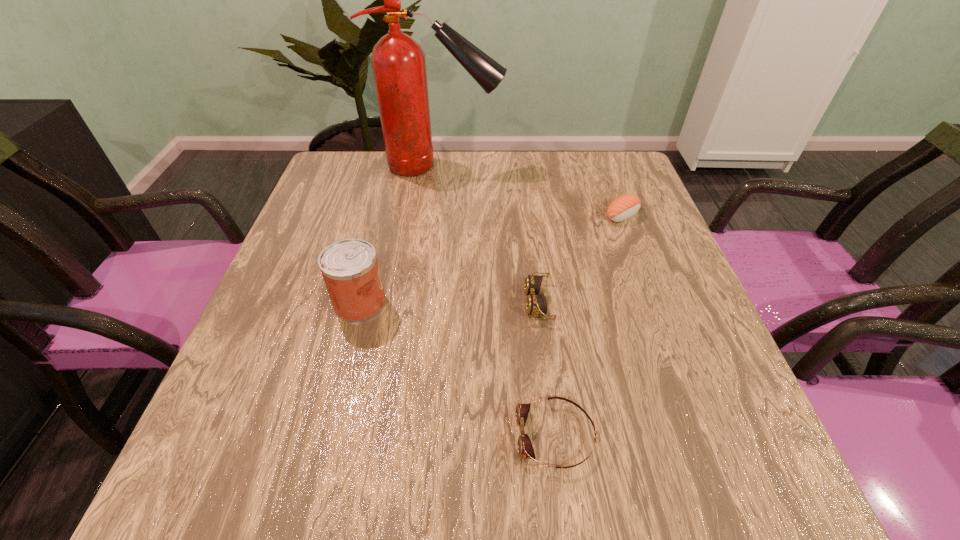
Find the location of `free space at the near right corner`. free space at the near right corner is located at coordinates (757, 507).

You are a GUI agent. You are given a task and a screenshot of the screen. Output one action in this format:
    pyautogui.click(x=<x>, y=<y>)
    Task: Click on the vacant space that is in between the can and the farthest object
    This screenshot has width=960, height=540.
    Given the screenshot: What is the action you would take?
    pyautogui.click(x=400, y=234)

Where is `free space between the shorter goggles and the farther goggles`? free space between the shorter goggles and the farther goggles is located at coordinates (547, 369).

Image resolution: width=960 pixels, height=540 pixels. I want to click on free space between the tallest object and the fourth nearest object, so click(532, 191).

Find the location of a particular element. The height and width of the screenshot is (540, 960). vacant space that is in between the nearer goggles and the second tallest object is located at coordinates (458, 369).

Identify the location of empty space between the tallest object and the shorter goggles. (498, 301).

Where is `free spot between the second shortest object and the second tallest object`? free spot between the second shortest object and the second tallest object is located at coordinates [x=449, y=303].

The image size is (960, 540). I want to click on free area in between the rightmost object and the shorter goggles, so click(589, 326).

I want to click on free space between the second shortest object and the tallest object, so click(x=490, y=234).

Identify the location of vacant area that lies between the taller goggles and the shorter goggles. The width and height of the screenshot is (960, 540). (547, 369).